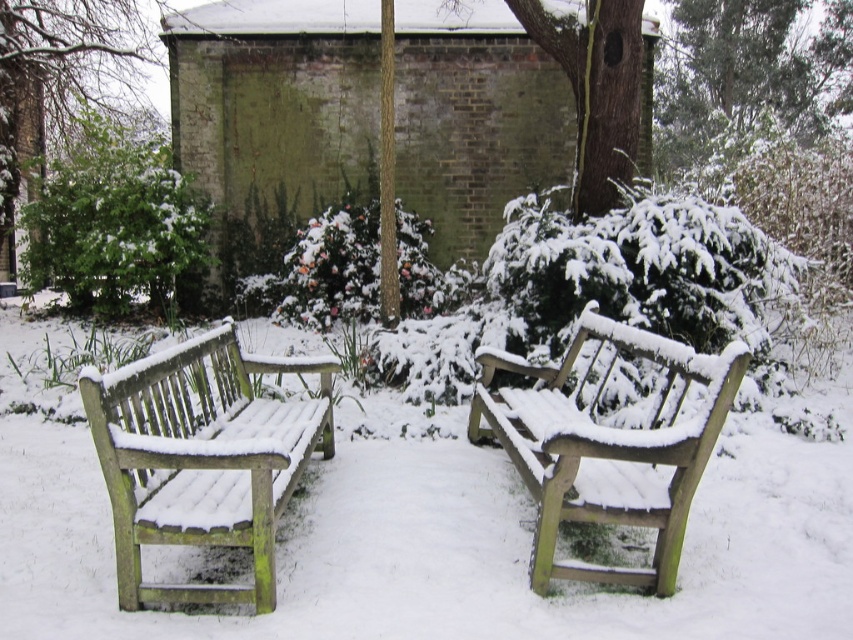
You are standing in the winter garden and want to place a small decoration between the two points, point (86, 412) and point (577, 513). Which point should you start from to ensure the decoration is closer to the camera?

You should start from point (86, 412) because it is closer to the camera than point (577, 513).

You are standing at the origin point in the winter garden scene. There is a green wood bench at left. Can you determine its coordinates?

The green wood bench at left is located at coordinates point (202, 458).